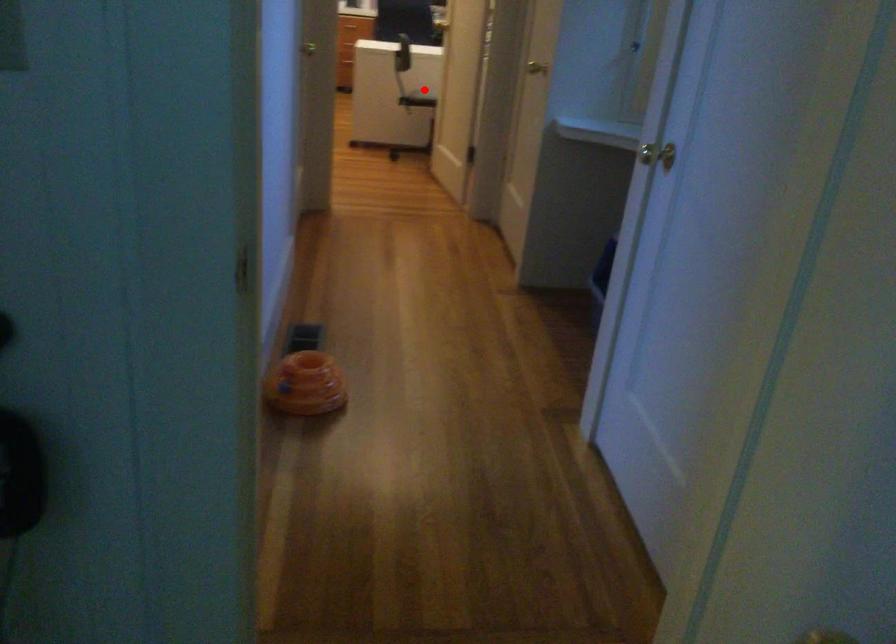
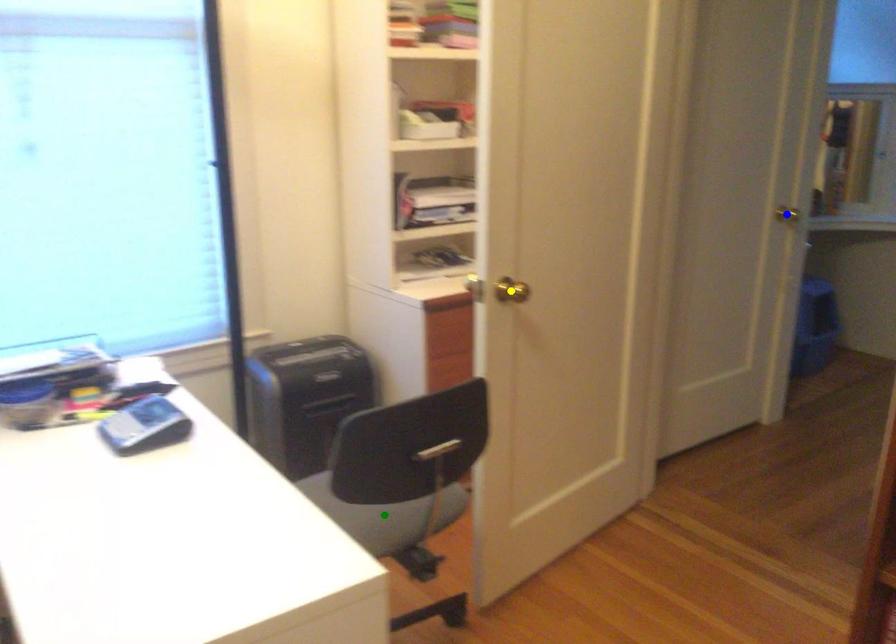
Question: I am providing you with two images of the same scene from different viewpoints. A red point is marked on the first image. You are given multiple points on the second image. In image 2, which mark is for the same physical point as the one in image 1?

Choices:
 (A) blue point
 (B) yellow point
 (C) green point

Answer: (C)